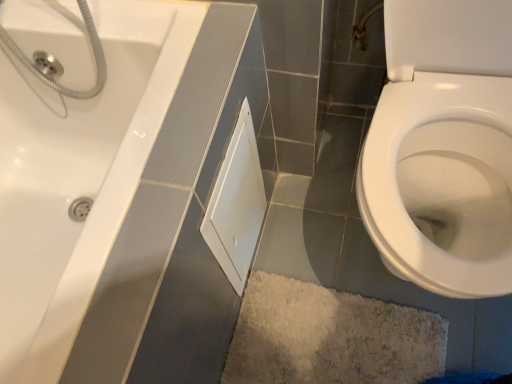
What is the approximate height of white glossy bidet at lower right?

white glossy bidet at lower right is 30.64 inches in height.

Measure the distance between white glossy bidet at lower right and camera.

66.03 centimeters.

At what (x,y) coordinates should I click in order to perform the action: click on white glossy bidet at lower right. Please return your answer as a coordinate pair (x, y). The height and width of the screenshot is (384, 512). Looking at the image, I should click on (442, 181).

This screenshot has width=512, height=384. Describe the element at coordinates (442, 181) in the screenshot. I see `white glossy bidet at lower right` at that location.

Where is `white matte cabinet at center`? This screenshot has height=384, width=512. white matte cabinet at center is located at coordinates pyautogui.click(x=236, y=204).

What do you see at coordinates (236, 204) in the screenshot? I see `white matte cabinet at center` at bounding box center [236, 204].

The height and width of the screenshot is (384, 512). I want to click on white glossy bidet at lower right, so click(442, 181).

Considering the positions of objects white glossy bidet at lower right and white matte cabinet at center in the image provided, who is more to the left, white glossy bidet at lower right or white matte cabinet at center?

Positioned to the left is white matte cabinet at center.

Considering the positions of objects white glossy bidet at lower right and white matte cabinet at center in the image provided, who is behind, white glossy bidet at lower right or white matte cabinet at center?

white matte cabinet at center is more distant.

Which is closer, (x=430, y=168) or (x=220, y=174)?

Point (x=430, y=168) is positioned farther from the camera compared to point (x=220, y=174).

From the image's perspective, between white glossy bidet at lower right and white matte cabinet at center, which one is located above?

white glossy bidet at lower right.

From a real-world perspective, is white glossy bidet at lower right positioned above or below white matte cabinet at center?

From a real-world perspective, white glossy bidet at lower right is physically above white matte cabinet at center.

Considering the relative sizes of white glossy bidet at lower right and white matte cabinet at center in the image provided, is white glossy bidet at lower right thinner than white matte cabinet at center?

Incorrect, the width of white glossy bidet at lower right is not less than that of white matte cabinet at center.

Is white glossy bidet at lower right shorter than white matte cabinet at center?

Incorrect, the height of white glossy bidet at lower right does not fall short of that of white matte cabinet at center.

In terms of size, does white glossy bidet at lower right appear bigger or smaller than white matte cabinet at center?

In the image, white glossy bidet at lower right appears to be larger than white matte cabinet at center.

Would you say white glossy bidet at lower right is inside or outside white matte cabinet at center?

white glossy bidet at lower right cannot be found inside white matte cabinet at center.

Based on the photo, are white glossy bidet at lower right and white matte cabinet at center beside each other?

There is a gap between white glossy bidet at lower right and white matte cabinet at center.

Is white glossy bidet at lower right positioned with its back to white matte cabinet at center?

No.

In the image, there is a white glossy bidet at lower right. At what (x,y) coordinates should I click in order to perform the action: click on screen door below it (from a real-world perspective). Please return your answer as a coordinate pair (x, y). Looking at the image, I should click on (236, 204).

Which is more to the left, white matte cabinet at center or white glossy bidet at lower right?

Positioned to the left is white matte cabinet at center.

Is white matte cabinet at center in front of white glossy bidet at lower right?

No, it is not.

From the picture: Which is farther from the camera, (201, 229) or (386, 139)?

The point (386, 139) is farther from the camera.

From the image's perspective, is white matte cabinet at center positioned above or below white glossy bidet at lower right?

Clearly, from the image's perspective, white matte cabinet at center is below white glossy bidet at lower right.

From a real-world perspective, who is located higher, white matte cabinet at center or white glossy bidet at lower right?

In real-world perspective, white glossy bidet at lower right is above.

Considering the sizes of white matte cabinet at center and white glossy bidet at lower right in the image, is white matte cabinet at center wider or thinner than white glossy bidet at lower right?

white matte cabinet at center is thinner than white glossy bidet at lower right.

In terms of height, does white matte cabinet at center look taller or shorter compared to white glossy bidet at lower right?

Clearly, white matte cabinet at center is shorter compared to white glossy bidet at lower right.

Looking at the image, does white matte cabinet at center seem bigger or smaller compared to white glossy bidet at lower right?

Clearly, white matte cabinet at center is smaller in size than white glossy bidet at lower right.

Is white matte cabinet at center surrounding white glossy bidet at lower right?

No, white glossy bidet at lower right is not inside white matte cabinet at center.

Is white matte cabinet at center far from white glossy bidet at lower right?

They are positioned close to each other.

Is white glossy bidet at lower right at the back of white matte cabinet at center?

white matte cabinet at center does not have its back to white glossy bidet at lower right.

How distant is white matte cabinet at center from white glossy bidet at lower right?

14.04 inches.

Image resolution: width=512 pixels, height=384 pixels. In the image, there is a white glossy bidet at lower right. Identify the location of screen door below it (from the image's perspective). (236, 204).

What are the coordinates of `bidet on the right of white matte cabinet at center` in the screenshot? It's located at (442, 181).

Locate an element on the screen. Image resolution: width=512 pixels, height=384 pixels. screen door on the left of white glossy bidet at lower right is located at coordinates (236, 204).